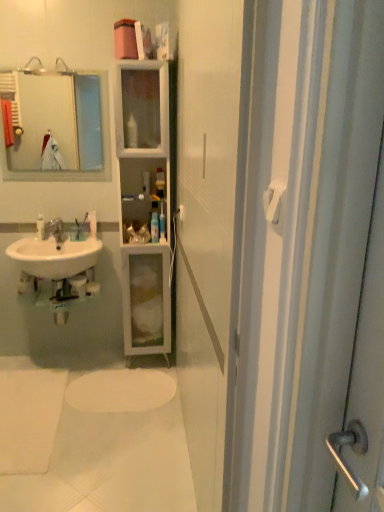
Question: From the image's perspective, is white plastic bottle at center, which appears as the 2th toiletry when viewed from the right, positioned above or below white glossy cabinet at center?

Choices:
 (A) above
 (B) below

Answer: (B)

Question: Is point (152, 215) closer or farther from the camera than point (167, 248)?

Choices:
 (A) closer
 (B) farther

Answer: (B)

Question: Which object is positioned closest to the white matte oval mat at lower center?

Choices:
 (A) white glossy toothbrush at left, the 1th toiletry in the left-to-right sequence
 (B) white glossy sink at lower left
 (C) white plastic towel bar at upper right
 (D) clear plastic toothbrush at center, the second toiletry from the left
 (E) brushed metal faucet at lower left

Answer: (B)

Question: Which object is positioned closest to the white plastic towel bar at upper right?

Choices:
 (A) matte glass mirror at upper left
 (B) white plastic bottle at center, which appears as the 2th toiletry when viewed from the right
 (C) clear plastic toothbrush at center, which is the third toiletry in right-to-left order
 (D) white glossy cabinet at center
 (E) white matte oval mat at lower center

Answer: (E)